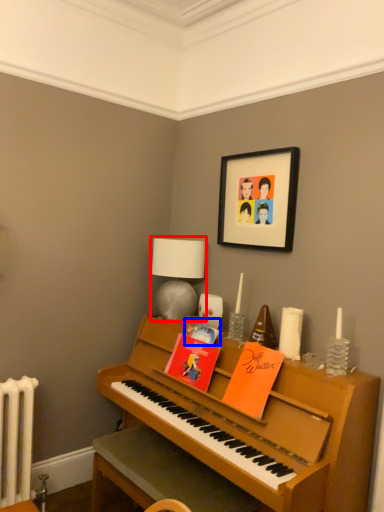
Question: Which of the following is the closest to the observer, table lamp (highlighted by a red box) or book (highlighted by a blue box)?

Choices:
 (A) table lamp
 (B) book

Answer: (B)